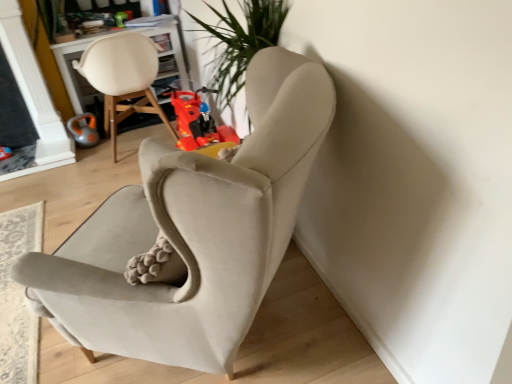
The image size is (512, 384). What are the coordinates of `orange rubber toy at left, which is the second toy from right to left` in the screenshot? It's located at (x=84, y=130).

How much space does orange rubber toy at left, marked as the first toy in a left-to-right arrangement, occupy horizontally?

orange rubber toy at left, marked as the first toy in a left-to-right arrangement, is 6.15 inches in width.

The height and width of the screenshot is (384, 512). I want to click on rubberized plastic toy motorcycle at center, the second toy in the left-to-right sequence, so click(199, 123).

Locate an element on the screen. suede beige armchair at center, positioned as the second chair in left-to-right order is located at coordinates (193, 232).

Can you confirm if orange rubber toy at left, marked as the first toy in a left-to-right arrangement, is taller than suede beige armchair at center, the first chair viewed from the right?

Yes, orange rubber toy at left, marked as the first toy in a left-to-right arrangement, is taller than suede beige armchair at center, the first chair viewed from the right.

Would you say orange rubber toy at left, which is the second toy from right to left, is a long distance from suede beige armchair at center, positioned as the second chair in left-to-right order?

Indeed, orange rubber toy at left, which is the second toy from right to left, is not near suede beige armchair at center, positioned as the second chair in left-to-right order.

From the picture: Is orange rubber toy at left, which is the second toy from right to left, looking in the opposite direction of suede beige armchair at center, the first chair viewed from the right?

No, orange rubber toy at left, which is the second toy from right to left,'s orientation is not away from suede beige armchair at center, the first chair viewed from the right.

Starting from the suede beige armchair at center, the first chair viewed from the right, which toy is the 2nd one behind? Please provide its 2D coordinates.

[(84, 130)]

From a real-world perspective, is rubberized plastic toy motorcycle at center, which is the first toy in right-to-left order, physically above orange rubber toy at left, marked as the first toy in a left-to-right arrangement?

Yes, from a real-world perspective, rubberized plastic toy motorcycle at center, which is the first toy in right-to-left order, is over orange rubber toy at left, marked as the first toy in a left-to-right arrangement

From the picture: Between rubberized plastic toy motorcycle at center, which is the first toy in right-to-left order, and orange rubber toy at left, marked as the first toy in a left-to-right arrangement, which one appears on the left side from the viewer's perspective?

orange rubber toy at left, marked as the first toy in a left-to-right arrangement, is more to the left.

Is point (231, 141) closer to camera compared to point (83, 127)?

Yes, it is in front of point (83, 127).

I want to click on chair above the orange rubber toy at left, marked as the first toy in a left-to-right arrangement (from a real-world perspective), so click(123, 78).

Can you see orange rubber toy at left, which is the second toy from right to left, touching matte white chair at upper left, which appears as the second chair when viewed from the right?

orange rubber toy at left, which is the second toy from right to left, is not next to matte white chair at upper left, which appears as the second chair when viewed from the right, and they're not touching.

Is orange rubber toy at left, which is the second toy from right to left, thinner than matte white chair at upper left, which appears as the second chair when viewed from the right?

Yes, orange rubber toy at left, which is the second toy from right to left, is thinner than matte white chair at upper left, which appears as the second chair when viewed from the right.

How much distance is there between rubberized plastic toy motorcycle at center, which is the first toy in right-to-left order, and matte white chair at upper left, marked as the 1th chair in a left-to-right arrangement?

The distance of rubberized plastic toy motorcycle at center, which is the first toy in right-to-left order, from matte white chair at upper left, marked as the 1th chair in a left-to-right arrangement, is 24.93 inches.

Does rubberized plastic toy motorcycle at center, the second toy in the left-to-right sequence, have a lesser width compared to matte white chair at upper left, marked as the 1th chair in a left-to-right arrangement?

Indeed, rubberized plastic toy motorcycle at center, the second toy in the left-to-right sequence, has a lesser width compared to matte white chair at upper left, marked as the 1th chair in a left-to-right arrangement.

Is rubberized plastic toy motorcycle at center, which is the first toy in right-to-left order, spatially inside matte white chair at upper left, which appears as the second chair when viewed from the right, or outside of it?

rubberized plastic toy motorcycle at center, which is the first toy in right-to-left order, cannot be found inside matte white chair at upper left, which appears as the second chair when viewed from the right.

Between rubberized plastic toy motorcycle at center, the second toy in the left-to-right sequence, and matte white chair at upper left, marked as the 1th chair in a left-to-right arrangement, which one has smaller size?

rubberized plastic toy motorcycle at center, the second toy in the left-to-right sequence, is smaller.

Which object is positioned more to the right, suede beige armchair at center, the first chair viewed from the right, or orange rubber toy at left, which is the second toy from right to left?

From the viewer's perspective, suede beige armchair at center, the first chair viewed from the right, appears more on the right side.

Are suede beige armchair at center, the first chair viewed from the right, and orange rubber toy at left, which is the second toy from right to left, making contact?

suede beige armchair at center, the first chair viewed from the right, and orange rubber toy at left, which is the second toy from right to left, are not in contact.

From a real-world perspective, does suede beige armchair at center, positioned as the second chair in left-to-right order, stand above orange rubber toy at left, which is the second toy from right to left?

No.

In the scene shown: Can you confirm if suede beige armchair at center, the first chair viewed from the right, is taller than orange rubber toy at left, which is the second toy from right to left?

Incorrect, the height of suede beige armchair at center, the first chair viewed from the right, is not larger of that of orange rubber toy at left, which is the second toy from right to left.

Based on the photo, is the depth of orange rubber toy at left, marked as the first toy in a left-to-right arrangement, greater than that of rubberized plastic toy motorcycle at center, the second toy in the left-to-right sequence?

Yes.

Consider the image. From the image's perspective, is orange rubber toy at left, marked as the first toy in a left-to-right arrangement, located above rubberized plastic toy motorcycle at center, the second toy in the left-to-right sequence?

Yes.

Can we say orange rubber toy at left, which is the second toy from right to left, lies outside rubberized plastic toy motorcycle at center, the second toy in the left-to-right sequence?

Yes.

Are orange rubber toy at left, which is the second toy from right to left, and rubberized plastic toy motorcycle at center, the second toy in the left-to-right sequence, located far from each other?

That's right, there is a large distance between orange rubber toy at left, which is the second toy from right to left, and rubberized plastic toy motorcycle at center, the second toy in the left-to-right sequence.

Is the position of rubberized plastic toy motorcycle at center, which is the first toy in right-to-left order, less distant than that of suede beige armchair at center, positioned as the second chair in left-to-right order?

That is False.

Looking at this image, between rubberized plastic toy motorcycle at center, the second toy in the left-to-right sequence, and suede beige armchair at center, the first chair viewed from the right, which one appears on the right side from the viewer's perspective?

From the viewer's perspective, rubberized plastic toy motorcycle at center, the second toy in the left-to-right sequence, appears more on the right side.

From the picture: Considering the relative sizes of rubberized plastic toy motorcycle at center, the second toy in the left-to-right sequence, and suede beige armchair at center, the first chair viewed from the right, in the image provided, is rubberized plastic toy motorcycle at center, the second toy in the left-to-right sequence, taller than suede beige armchair at center, the first chair viewed from the right,?

Yes, rubberized plastic toy motorcycle at center, the second toy in the left-to-right sequence, is taller than suede beige armchair at center, the first chair viewed from the right.

Where is `chair below the rubberized plastic toy motorcycle at center, the second toy in the left-to-right sequence (from a real-world perspective)`? This screenshot has width=512, height=384. chair below the rubberized plastic toy motorcycle at center, the second toy in the left-to-right sequence (from a real-world perspective) is located at coordinates (193, 232).

Find the location of a particular element. The image size is (512, 384). chair below the orange rubber toy at left, which is the second toy from right to left (from a real-world perspective) is located at coordinates (193, 232).

The image size is (512, 384). In the image, there is a rubberized plastic toy motorcycle at center, the second toy in the left-to-right sequence. In order to click on toy above it (from the image's perspective) in this screenshot , I will do `click(84, 130)`.

Which object lies nearer to the anchor point orange rubber toy at left, which is the second toy from right to left, suede beige armchair at center, the first chair viewed from the right, or matte white chair at upper left, marked as the 1th chair in a left-to-right arrangement?

matte white chair at upper left, marked as the 1th chair in a left-to-right arrangement, lies closer to orange rubber toy at left, which is the second toy from right to left, than the other object.

When comparing their distances from matte white chair at upper left, marked as the 1th chair in a left-to-right arrangement, does orange rubber toy at left, which is the second toy from right to left, or rubberized plastic toy motorcycle at center, which is the first toy in right-to-left order, seem further?

Among the two, rubberized plastic toy motorcycle at center, which is the first toy in right-to-left order, is located further to matte white chair at upper left, marked as the 1th chair in a left-to-right arrangement.

Based on the photo, considering their positions, is rubberized plastic toy motorcycle at center, the second toy in the left-to-right sequence, positioned closer to orange rubber toy at left, marked as the first toy in a left-to-right arrangement, than matte white chair at upper left, which appears as the second chair when viewed from the right?

Based on the image, matte white chair at upper left, which appears as the second chair when viewed from the right, appears to be nearer to orange rubber toy at left, marked as the first toy in a left-to-right arrangement.

Considering their positions, is suede beige armchair at center, positioned as the second chair in left-to-right order, positioned further to rubberized plastic toy motorcycle at center, which is the first toy in right-to-left order, than orange rubber toy at left, which is the second toy from right to left?

orange rubber toy at left, which is the second toy from right to left, is further to rubberized plastic toy motorcycle at center, which is the first toy in right-to-left order.

When comparing their distances from suede beige armchair at center, positioned as the second chair in left-to-right order, does rubberized plastic toy motorcycle at center, which is the first toy in right-to-left order, or orange rubber toy at left, which is the second toy from right to left, seem closer?

rubberized plastic toy motorcycle at center, which is the first toy in right-to-left order, is closer to suede beige armchair at center, positioned as the second chair in left-to-right order.

Based on their spatial positions, is orange rubber toy at left, which is the second toy from right to left, or matte white chair at upper left, marked as the 1th chair in a left-to-right arrangement, further from rubberized plastic toy motorcycle at center, which is the first toy in right-to-left order?

orange rubber toy at left, which is the second toy from right to left, is positioned further to the anchor rubberized plastic toy motorcycle at center, which is the first toy in right-to-left order.

Based on their spatial positions, is suede beige armchair at center, positioned as the second chair in left-to-right order, or rubberized plastic toy motorcycle at center, which is the first toy in right-to-left order, further from matte white chair at upper left, which appears as the second chair when viewed from the right?

suede beige armchair at center, positioned as the second chair in left-to-right order, lies further to matte white chair at upper left, which appears as the second chair when viewed from the right, than the other object.

Estimate the real-world distances between objects in this image. Which object is closer to orange rubber toy at left, which is the second toy from right to left, matte white chair at upper left, marked as the 1th chair in a left-to-right arrangement, or rubberized plastic toy motorcycle at center, which is the first toy in right-to-left order?

The object closer to orange rubber toy at left, which is the second toy from right to left, is matte white chair at upper left, marked as the 1th chair in a left-to-right arrangement.

I want to click on toy between suede beige armchair at center, positioned as the second chair in left-to-right order, and matte white chair at upper left, marked as the 1th chair in a left-to-right arrangement, from front to back, so point(199,123).

Where is `chair between suede beige armchair at center, positioned as the second chair in left-to-right order, and orange rubber toy at left, which is the second toy from right to left, along the z-axis`? The height and width of the screenshot is (384, 512). chair between suede beige armchair at center, positioned as the second chair in left-to-right order, and orange rubber toy at left, which is the second toy from right to left, along the z-axis is located at coordinates (123, 78).

You are a GUI agent. You are given a task and a screenshot of the screen. Output one action in this format:
    pyautogui.click(x=<x>, y=<y>)
    Task: Click on the toy between suede beige armchair at center, the first chair viewed from the right, and orange rubber toy at left, which is the second toy from right to left, in the front-back direction
    The width and height of the screenshot is (512, 384).
    Given the screenshot: What is the action you would take?
    pyautogui.click(x=199, y=123)